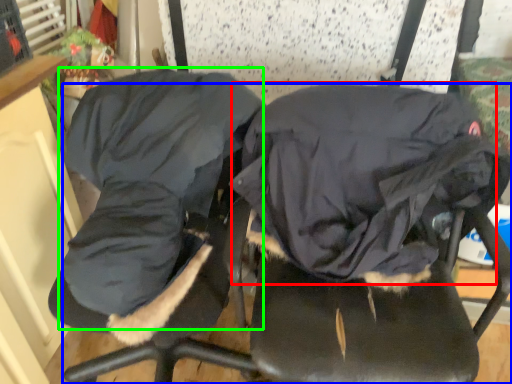
Question: Which object is positioned farthest from sleeping bag (highlighted by a red box)? Select from chair (highlighted by a blue box) and clothing (highlighted by a green box).

Choices:
 (A) chair
 (B) clothing

Answer: (B)